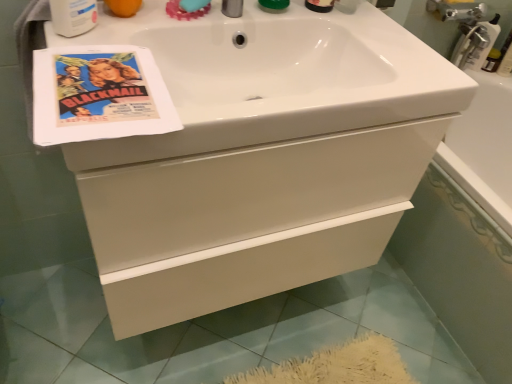
Identify the location of free region under vintage paper flyer at upper left (from a real-world perspective). (103, 91).